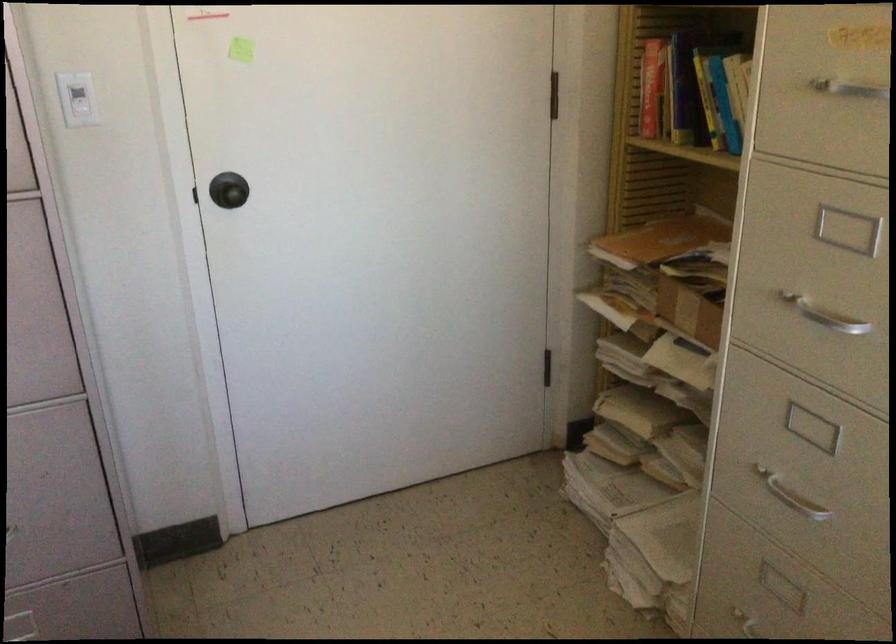
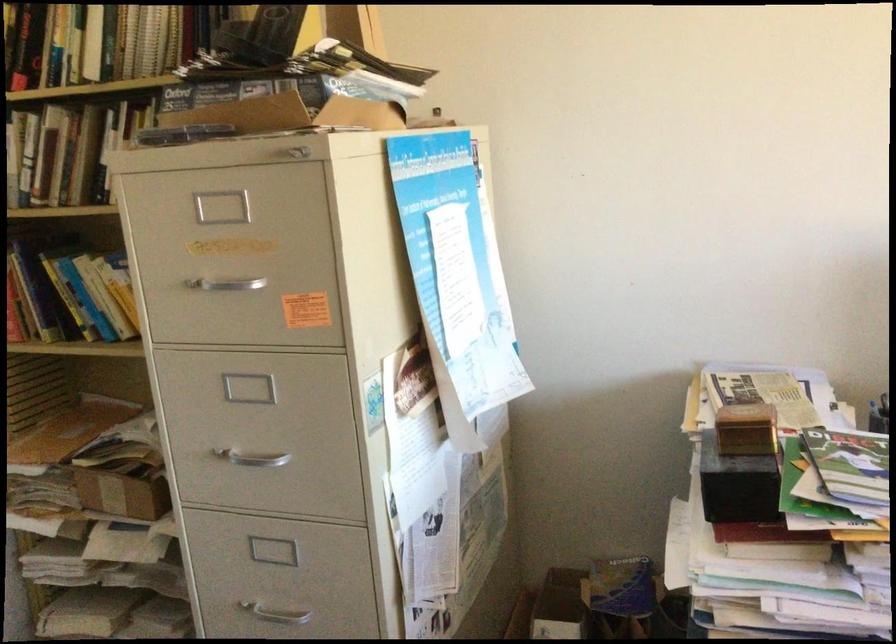
Question: Based on the continuous images, in which direction is the camera rotating? Reply with the corresponding letter.

Choices:
 (A) Left
 (B) Right
 (C) Up
 (D) Down

Answer: (B)